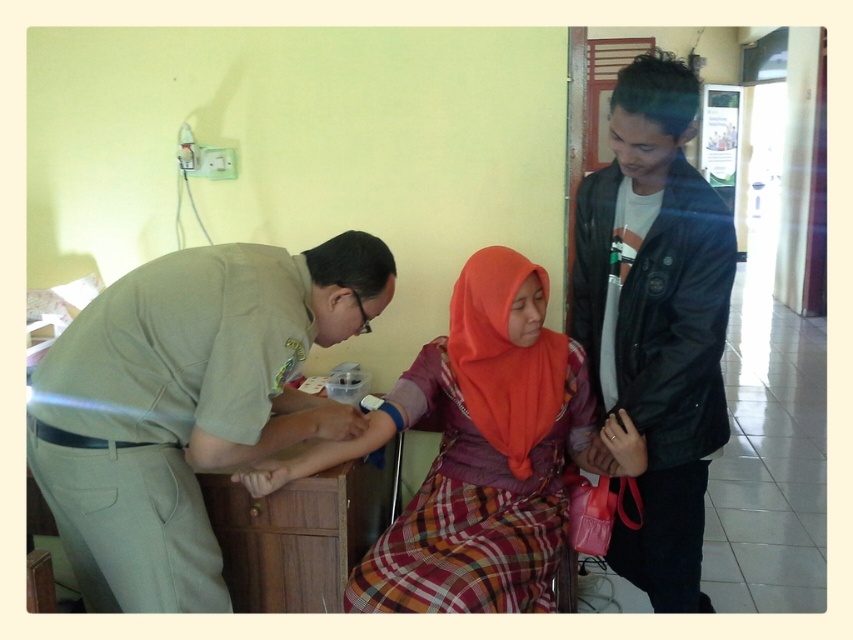
Does point (653, 588) lie in front of point (502, 301)?

No, (653, 588) is further to viewer.

Where is `black leather jacket at right`? black leather jacket at right is located at coordinates (654, 324).

Is khaki uniform at center thinner than matte orange hijab at center?

Yes.

Is point (349, 285) positioned before point (456, 438)?

Yes, point (349, 285) is in front of point (456, 438).

Does point (138, 486) come in front of point (572, 372)?

Yes, point (138, 486) is in front of point (572, 372).

I want to click on khaki uniform at center, so click(187, 404).

Is khaki uniform at center below wooden drawer at lower left?

No, khaki uniform at center is not below wooden drawer at lower left.

Between khaki uniform at center and wooden drawer at lower left, which one has more height?

khaki uniform at center

Identify the location of khaki uniform at center. This screenshot has height=640, width=853. (187, 404).